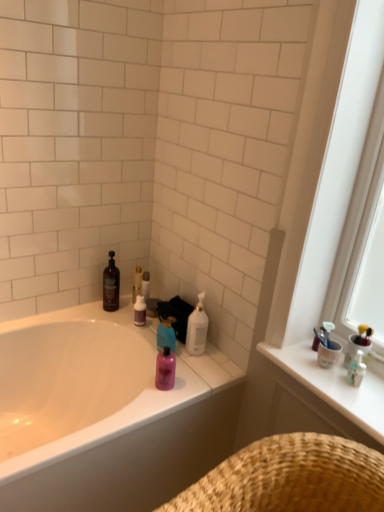
You are a GUI agent. You are given a task and a screenshot of the screen. Output one action in this format:
    pyautogui.click(x=<x>, y=<y>)
    Task: Click on the translucent plastic toothbrush holder at upper right, the 3th toiletry in the left-to-right sequence
    The height and width of the screenshot is (512, 384).
    Given the screenshot: What is the action you would take?
    pyautogui.click(x=356, y=369)

The width and height of the screenshot is (384, 512). I want to click on matte white bathtub at center, so click(105, 413).

I want to click on blue glossy bottle at center, arranged as the 2th cleaning product when viewed from the right, so click(166, 334).

Describe the element at coordinates (197, 328) in the screenshot. This screenshot has width=384, height=512. I see `white glossy bottle at upper center, marked as the first cleaning product in a right-to-left arrangement` at that location.

Describe the element at coordinates (139, 311) in the screenshot. I see `purple matte bottle at center, the first toiletry viewed from the left` at that location.

What is the approximate height of white matte toilet paper at upper center?

It is 14.07 centimeters.

What are the coordinates of `translucent plastic toothbrush holder at upper right, which is counted as the 1th toiletry, starting from the front` in the screenshot? It's located at (356, 369).

Could you tell me if blue glossy bottle at center, which ranks as the second cleaning product in left-to-right order, is turned towards white matte toilet paper at upper center?

No, blue glossy bottle at center, which ranks as the second cleaning product in left-to-right order, is not facing towards white matte toilet paper at upper center.

Who is taller, blue glossy bottle at center, which ranks as the second cleaning product in left-to-right order, or white matte toilet paper at upper center?

blue glossy bottle at center, which ranks as the second cleaning product in left-to-right order, is taller.

Where is `the 2nd cleaning product below when counting from the white matte toilet paper at upper center (from the image's perspective)`? The width and height of the screenshot is (384, 512). the 2nd cleaning product below when counting from the white matte toilet paper at upper center (from the image's perspective) is located at coordinates pos(166,334).

Could you measure the distance between blue glossy bottle at center, arranged as the 2th cleaning product when viewed from the right, and white matte toilet paper at upper center?

A distance of 12.69 inches exists between blue glossy bottle at center, arranged as the 2th cleaning product when viewed from the right, and white matte toilet paper at upper center.

Can we say white matte toilet paper at upper center lies outside white glossy bottle at upper center, which appears as the third cleaning product when viewed from the left?

That's correct, white matte toilet paper at upper center is outside of white glossy bottle at upper center, which appears as the third cleaning product when viewed from the left.

How different are the orientations of white matte toilet paper at upper center and white glossy bottle at upper center, marked as the first cleaning product in a right-to-left arrangement, in degrees?

The facing directions of white matte toilet paper at upper center and white glossy bottle at upper center, marked as the first cleaning product in a right-to-left arrangement, are 0.00222 degrees apart.

How much distance is there between white matte toilet paper at upper center and white glossy bottle at upper center, marked as the first cleaning product in a right-to-left arrangement?

They are 13.90 inches apart.

Is white matte toilet paper at upper center facing towards white glossy bottle at upper center, marked as the first cleaning product in a right-to-left arrangement?

No.

In terms of width, does translucent plastic toothbrush holder at upper right, the 1th toiletry from the right, look wider or thinner when compared to matte black bottle at upper left, arranged as the third cleaning product when viewed from the right?

Clearly, translucent plastic toothbrush holder at upper right, the 1th toiletry from the right, has less width compared to matte black bottle at upper left, arranged as the third cleaning product when viewed from the right.

Between translucent plastic toothbrush holder at upper right, marked as the third toiletry in a back-to-front arrangement, and matte black bottle at upper left, marked as the first cleaning product in a left-to-right arrangement, which one appears on the right side from the viewer's perspective?

translucent plastic toothbrush holder at upper right, marked as the third toiletry in a back-to-front arrangement, is more to the right.

Considering the points (358, 377) and (113, 273), which point is in front, point (358, 377) or point (113, 273)?

Positioned in front is point (358, 377).

How different are the orientations of white glossy counter top at upper right and matte black bottle at upper left, marked as the first cleaning product in a left-to-right arrangement, in degrees?

The angle between the facing direction of white glossy counter top at upper right and the facing direction of matte black bottle at upper left, marked as the first cleaning product in a left-to-right arrangement, is 89.4 degrees.

From the image's perspective, does white glossy counter top at upper right appear lower than matte black bottle at upper left, marked as the first cleaning product in a left-to-right arrangement?

Yes, from the image's perspective, white glossy counter top at upper right is beneath matte black bottle at upper left, marked as the first cleaning product in a left-to-right arrangement.

Are white glossy counter top at upper right and matte black bottle at upper left, marked as the first cleaning product in a left-to-right arrangement, located far from each other?

Actually, white glossy counter top at upper right and matte black bottle at upper left, marked as the first cleaning product in a left-to-right arrangement, are a little close together.

The image size is (384, 512). I want to click on counter top that is above the matte black bottle at upper left, arranged as the third cleaning product when viewed from the right (from a real-world perspective), so click(334, 385).

From the image's perspective, is white matte toilet paper at upper center above matte white bathtub at center?

Yes, from the image's perspective, white matte toilet paper at upper center is over matte white bathtub at center.

Consider the image. Is matte white bathtub at center located within white matte toilet paper at upper center?

No.

From a real-world perspective, is white matte toilet paper at upper center physically above matte white bathtub at center?

Yes.

Which point is more distant from viewer, [147,281] or [70,428]?

The point [147,281] is more distant.

Can we say white glossy bottle at upper center, which appears as the third cleaning product when viewed from the left, lies outside matte black bottle at upper left, marked as the first cleaning product in a left-to-right arrangement?

Yes, white glossy bottle at upper center, which appears as the third cleaning product when viewed from the left, is located beyond the bounds of matte black bottle at upper left, marked as the first cleaning product in a left-to-right arrangement.

In the scene shown: Can you confirm if white glossy bottle at upper center, marked as the first cleaning product in a right-to-left arrangement, is bigger than matte black bottle at upper left, arranged as the third cleaning product when viewed from the right?

Yes, white glossy bottle at upper center, marked as the first cleaning product in a right-to-left arrangement, is bigger than matte black bottle at upper left, arranged as the third cleaning product when viewed from the right.

From the image's perspective, is white glossy bottle at upper center, marked as the first cleaning product in a right-to-left arrangement, on matte black bottle at upper left, arranged as the third cleaning product when viewed from the right?

No.

Which is more to the right, white glossy bottle at upper center, which appears as the third cleaning product when viewed from the left, or matte black bottle at upper left, marked as the first cleaning product in a left-to-right arrangement?

From the viewer's perspective, white glossy bottle at upper center, which appears as the third cleaning product when viewed from the left, appears more on the right side.

Is pink glossy bottle at center, the second toiletry positioned from the front, placed right next to white matte toilet paper at upper center?

There is a gap between pink glossy bottle at center, the second toiletry positioned from the front, and white matte toilet paper at upper center.

From the image's perspective, would you say pink glossy bottle at center, the second toiletry positioned from the front, is shown under white matte toilet paper at upper center?

Yes.

Is pink glossy bottle at center, the second toiletry positioned from the front, aimed at white matte toilet paper at upper center?

No, pink glossy bottle at center, the second toiletry positioned from the front, is not turned towards white matte toilet paper at upper center.

What's the angular difference between pink glossy bottle at center, the second toiletry viewed from the back, and white matte toilet paper at upper center's facing directions?

The facing directions of pink glossy bottle at center, the second toiletry viewed from the back, and white matte toilet paper at upper center are 0.00206 degrees apart.

From the white matte toilet paper at upper center, count 2nd cleaning products forward and point to it. Please provide its 2D coordinates.

[(166, 334)]

Locate an element on the screen. The image size is (384, 512). the 1st cleaning product below the white matte toilet paper at upper center (from the image's perspective) is located at coordinates (197, 328).

Which object lies further to the anchor point matte black bottle at upper left, arranged as the third cleaning product when viewed from the right, translucent plastic toothbrush holder at upper right, marked as the third toiletry in a back-to-front arrangement, or matte white bathtub at center?

translucent plastic toothbrush holder at upper right, marked as the third toiletry in a back-to-front arrangement, is further to matte black bottle at upper left, arranged as the third cleaning product when viewed from the right.

Which object lies nearer to the anchor point white glossy bottle at upper center, marked as the first cleaning product in a right-to-left arrangement, translucent plastic toothbrush holder at upper right, marked as the third toiletry in a back-to-front arrangement, or matte black bottle at upper left, marked as the first cleaning product in a left-to-right arrangement?

matte black bottle at upper left, marked as the first cleaning product in a left-to-right arrangement, lies closer to white glossy bottle at upper center, marked as the first cleaning product in a right-to-left arrangement, than the other object.

Looking at the image, which one is located closer to purple matte bottle at center, the third toiletry from the front, pink glossy bottle at center, the second toiletry positioned from the front, or white glossy bottle at upper center, which appears as the third cleaning product when viewed from the left?

white glossy bottle at upper center, which appears as the third cleaning product when viewed from the left.

Looking at the image, which one is located further to white glossy counter top at upper right, white glossy bottle at upper center, marked as the first cleaning product in a right-to-left arrangement, or purple matte bottle at center, the first toiletry viewed from the left?

purple matte bottle at center, the first toiletry viewed from the left, is further to white glossy counter top at upper right.

Estimate the real-world distances between objects in this image. Which object is further from white matte toilet paper at upper center, blue glossy bottle at center, arranged as the 2th cleaning product when viewed from the right, or matte white bathtub at center?

matte white bathtub at center is positioned further to the anchor white matte toilet paper at upper center.

Consider the image. Considering their positions, is white glossy counter top at upper right positioned closer to translucent plastic toothbrush holder at upper right, the 1th toiletry from the right, than pink glossy bottle at center, positioned as the 2th toiletry in right-to-left order?

white glossy counter top at upper right.

From the image, which object appears to be nearer to matte white bathtub at center, pink glossy bottle at center, the second toiletry positioned from the front, or matte black bottle at upper left, marked as the first cleaning product in a left-to-right arrangement?

pink glossy bottle at center, the second toiletry positioned from the front.

When comparing their distances from white glossy bottle at upper center, which appears as the third cleaning product when viewed from the left, does blue glossy bottle at center, which ranks as the second cleaning product in left-to-right order, or white matte toilet paper at upper center seem closer?

blue glossy bottle at center, which ranks as the second cleaning product in left-to-right order, is positioned closer to the anchor white glossy bottle at upper center, which appears as the third cleaning product when viewed from the left.

Identify the location of counter top between purple matte bottle at center, positioned as the 1th toiletry in back-to-front order, and translucent plastic toothbrush holder at upper right, the 3th toiletry in the left-to-right sequence, in the horizontal direction. (334, 385).

Where is `toiletry situated between blue glossy bottle at center, which ranks as the second cleaning product in left-to-right order, and white glossy counter top at upper right from left to right`? toiletry situated between blue glossy bottle at center, which ranks as the second cleaning product in left-to-right order, and white glossy counter top at upper right from left to right is located at coordinates (165, 369).

Find the location of `counter top situated between blue glossy bottle at center, arranged as the 2th cleaning product when viewed from the right, and translucent plastic toothbrush holder at upper right, the 1th toiletry from the right, from left to right`. counter top situated between blue glossy bottle at center, arranged as the 2th cleaning product when viewed from the right, and translucent plastic toothbrush holder at upper right, the 1th toiletry from the right, from left to right is located at coordinates (334, 385).

Image resolution: width=384 pixels, height=512 pixels. What are the coordinates of `counter top located between white glossy bottle at upper center, marked as the first cleaning product in a right-to-left arrangement, and translucent plastic toothbrush holder at upper right, the 3th toiletry in the left-to-right sequence, in the left-right direction` in the screenshot? It's located at (334, 385).